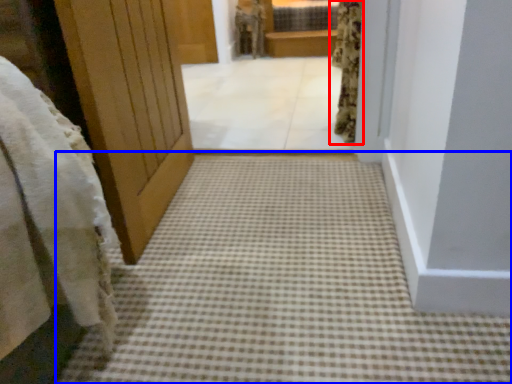
Question: Among these objects, which one is nearest to the camera, curtain (highlighted by a red box) or path (highlighted by a blue box)?

Choices:
 (A) curtain
 (B) path

Answer: (B)